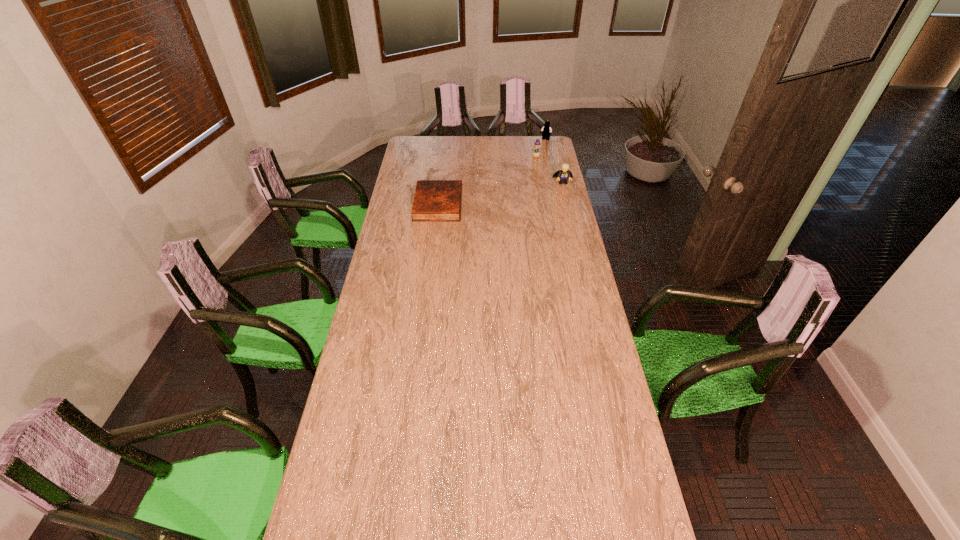
Identify the location of free space between the leftmost object and the nearer Lego. (500, 193).

Where is `the third closest object to the farthest object`? the third closest object to the farthest object is located at coordinates (435, 200).

Locate an element on the screen. object identified as the third closest to the second object from left to right is located at coordinates (435, 200).